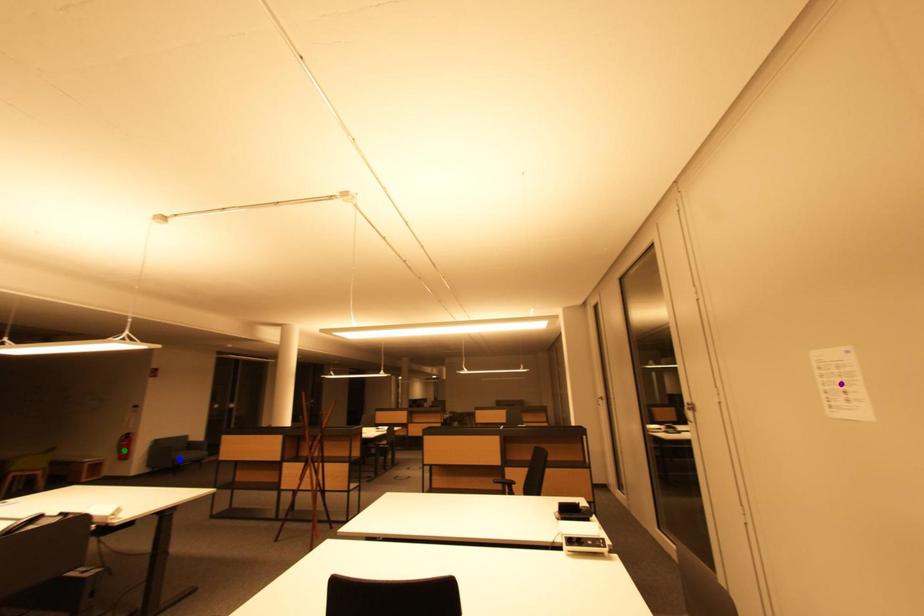
Based on the photo, order these from nearest to farthest:
blue point | purple point | green point

purple point < green point < blue point